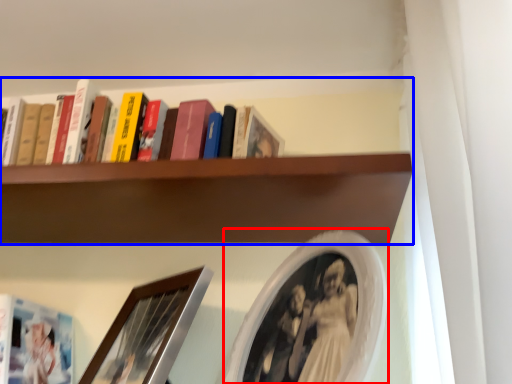
Question: Among these objects, which one is nearest to the camera, picture frame (highlighted by a red box) or shelf (highlighted by a blue box)?

Choices:
 (A) picture frame
 (B) shelf

Answer: (A)